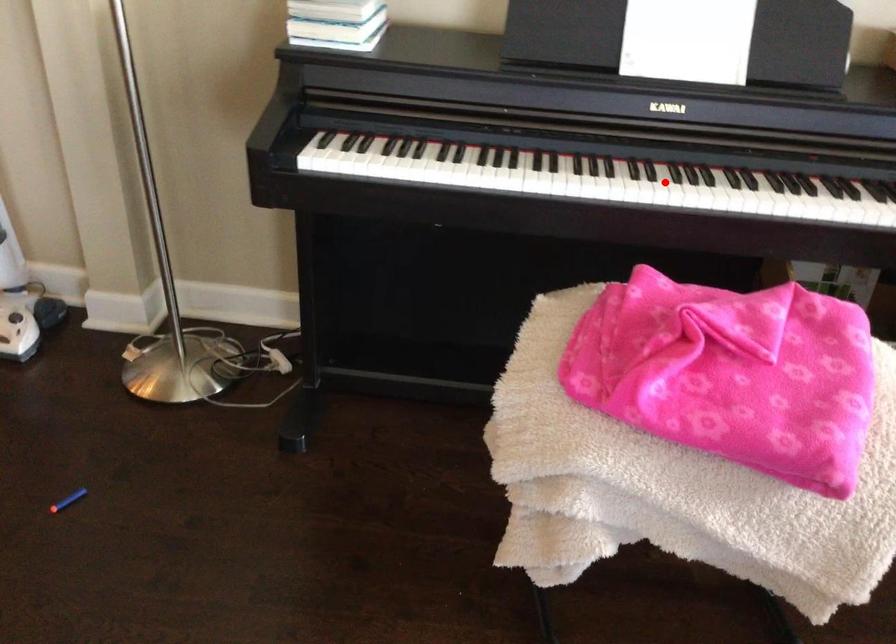
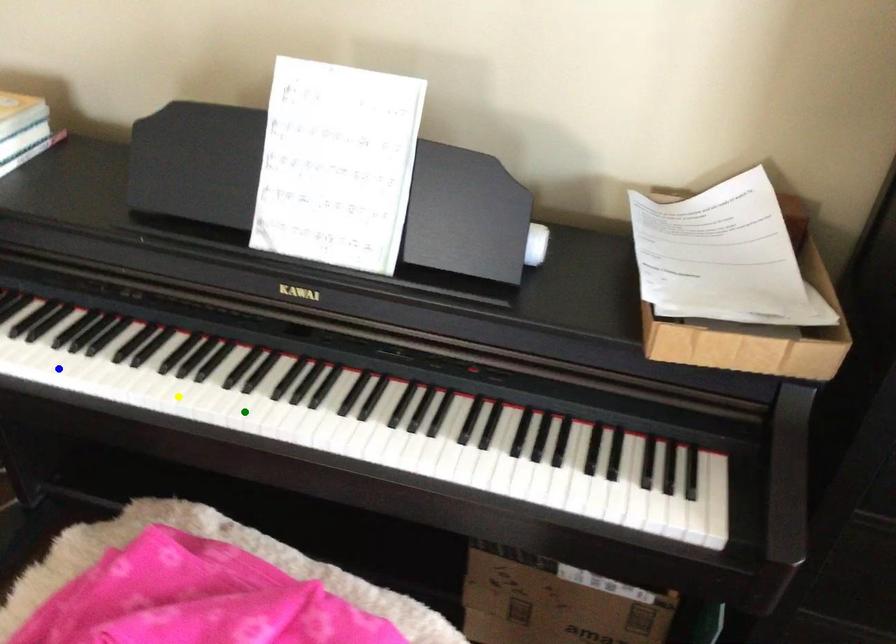
Question: I am providing you with two images of the same scene from different viewpoints. A red point is marked on the first image. You are given multiple points on the second image. Which mark in image 2 goes with the point in image 1?

Choices:
 (A) green point
 (B) yellow point
 (C) blue point

Answer: (A)